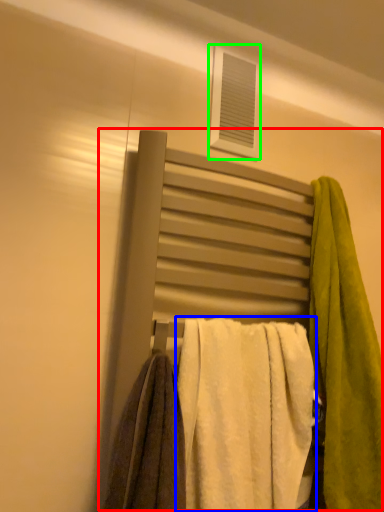
Question: Estimate the real-world distances between objects in this image. Which object is farther from bed (highlighted by a red box), towel (highlighted by a blue box) or window (highlighted by a green box)?

Choices:
 (A) towel
 (B) window

Answer: (B)